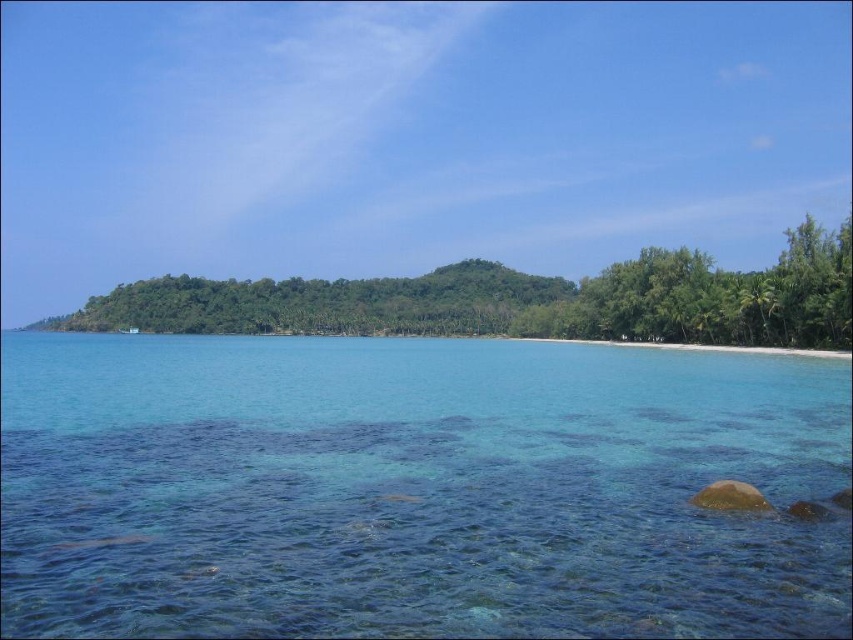
Question: Does clear blue water at center appear on the right side of green leafy trees at center?

Choices:
 (A) yes
 (B) no

Answer: (A)

Question: Is the position of clear blue water at center more distant than that of green leafy trees at center?

Choices:
 (A) yes
 (B) no

Answer: (B)

Question: Which point is closer to the camera?

Choices:
 (A) green leafy trees at center
 (B) clear blue water at center

Answer: (B)

Question: Can you confirm if clear blue water at center is thinner than green leafy trees at center?

Choices:
 (A) yes
 (B) no

Answer: (A)